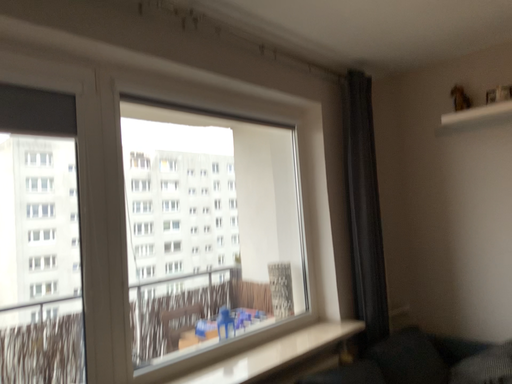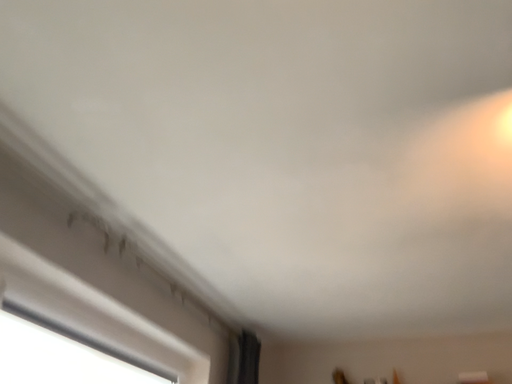
Question: How did the camera likely rotate when shooting the video?

Choices:
 (A) rotated upward
 (B) rotated downward

Answer: (A)